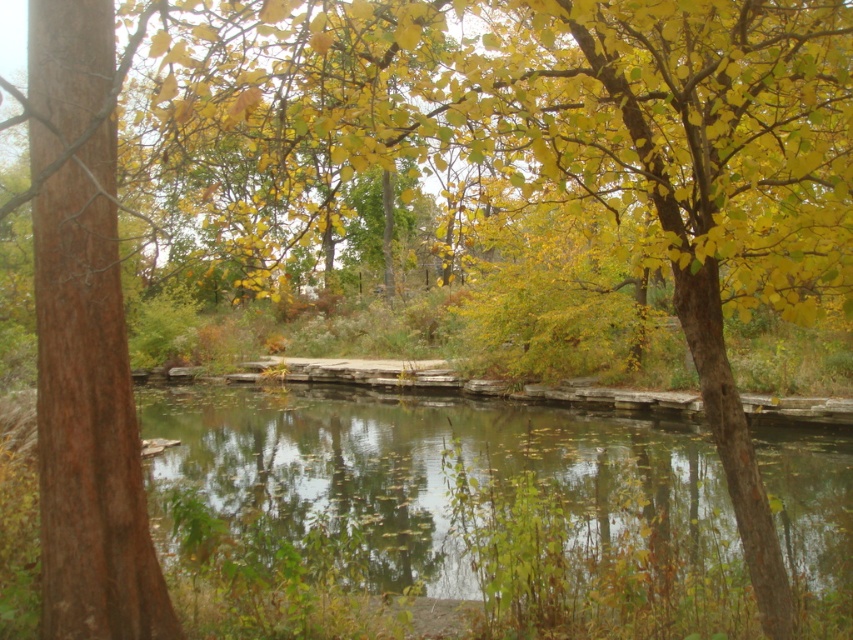
Question: Can you confirm if clear water at center is positioned to the right of brown rough bark tree at left?

Choices:
 (A) no
 (B) yes

Answer: (B)

Question: Which point is farther from the camera taking this photo?

Choices:
 (A) (440, 531)
 (B) (44, 320)

Answer: (A)

Question: Can you confirm if clear water at center is positioned below brown rough bark tree at left?

Choices:
 (A) yes
 (B) no

Answer: (A)

Question: Which point is farther from the camera taking this photo?

Choices:
 (A) (144, 13)
 (B) (230, 481)

Answer: (B)

Question: Is clear water at center to the right of brown rough bark tree at left from the viewer's perspective?

Choices:
 (A) yes
 (B) no

Answer: (A)